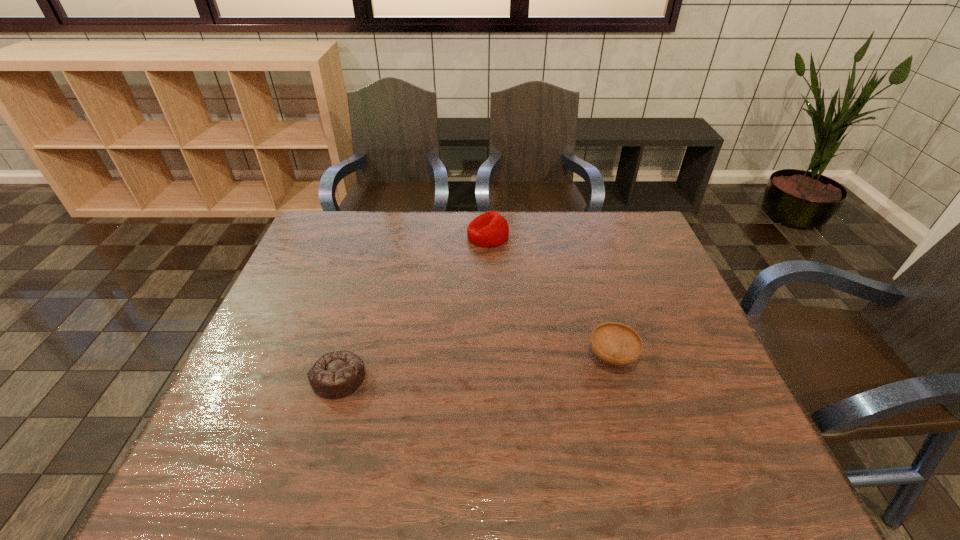
Image resolution: width=960 pixels, height=540 pixels. Find the location of `the taller beanbag`. the taller beanbag is located at coordinates (490, 229).

The height and width of the screenshot is (540, 960). I want to click on the farthest object, so click(490, 229).

Find the location of a particular element. The height and width of the screenshot is (540, 960). the rightmost object is located at coordinates (x=617, y=344).

Find the location of a particular element. The height and width of the screenshot is (540, 960). the shorter beanbag is located at coordinates (337, 374).

Identify the location of the leftmost object. (337, 374).

At what (x,y) coordinates should I click in order to perform the action: click on vacant position located on the seat area of the right beanbag. Please return your answer as a coordinate pair (x, y). This screenshot has height=540, width=960. Looking at the image, I should click on (401, 236).

Where is `vacant space located on the seat area of the right beanbag`? vacant space located on the seat area of the right beanbag is located at coordinates (416, 236).

Locate an element on the screen. free space located 0.320m on the seat area of the right beanbag is located at coordinates (372, 236).

The width and height of the screenshot is (960, 540). Find the location of `free space located 0.190m on the back of the rightmost object`. free space located 0.190m on the back of the rightmost object is located at coordinates (592, 289).

Find the location of a particular element. free space located on the front of the nearer beanbag is located at coordinates (324, 429).